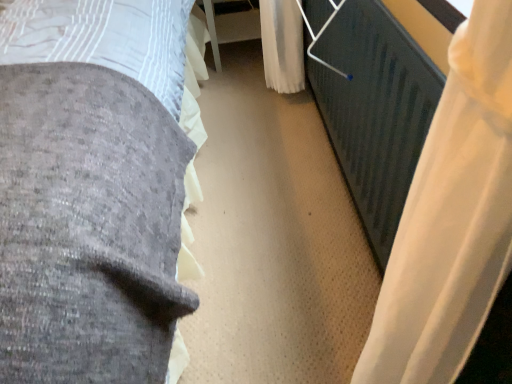
What is the approximate width of velvet gray bed at left?

velvet gray bed at left is 2.17 meters in width.

What do you see at coordinates (451, 217) in the screenshot? This screenshot has width=512, height=384. I see `white sheer curtain at right` at bounding box center [451, 217].

The image size is (512, 384). I want to click on white plastic table at center, so click(x=229, y=27).

Identify the location of table that is on the right side of velvet gray bed at left. This screenshot has width=512, height=384. (229, 27).

Visually, is velvet gray bed at left positioned to the left or to the right of white plastic table at center?

Clearly, velvet gray bed at left is on the left of white plastic table at center in the image.

Is velvet gray bed at left taller or shorter than white plastic table at center?

In the image, velvet gray bed at left appears to be taller than white plastic table at center.

Which object is further away from the camera, velvet gray bed at left or white plastic table at center?

white plastic table at center is further from the camera.

Between white sheer curtain at right and white plastic table at center, which one has larger size?

With larger size is white plastic table at center.

From the image's perspective, would you say white sheer curtain at right is positioned over white plastic table at center?

No, from the image's perspective, white sheer curtain at right is not on top of white plastic table at center.

Does white sheer curtain at right come in front of white plastic table at center?

Yes, white sheer curtain at right is closer to the viewer.

Is white sheer curtain at right with white plastic table at center?

They are not placed beside each other.

Between velvet gray bed at left and white sheer curtain at right, which one has larger size?

velvet gray bed at left.

Considering the relative positions of velvet gray bed at left and white sheer curtain at right in the image provided, is velvet gray bed at left in front of white sheer curtain at right?

Yes, the depth of velvet gray bed at left is less than that of white sheer curtain at right.

Between velvet gray bed at left and white sheer curtain at right, which one has larger width?

Wider between the two is velvet gray bed at left.

Is velvet gray bed at left not close to white sheer curtain at right?

No, velvet gray bed at left is in close proximity to white sheer curtain at right.

Considering the sizes of objects white sheer curtain at right and velvet gray bed at left in the image provided, who is thinner, white sheer curtain at right or velvet gray bed at left?

With smaller width is white sheer curtain at right.

Is white sheer curtain at right facing towards velvet gray bed at left?

Yes, white sheer curtain at right is oriented towards velvet gray bed at left.

Can you see white sheer curtain at right touching velvet gray bed at left?

white sheer curtain at right and velvet gray bed at left are clearly separated.

Does white plastic table at center appear on the right side of velvet gray bed at left?

Yes.

Can we say white plastic table at center lies outside velvet gray bed at left?

No, white plastic table at center is not outside of velvet gray bed at left.

Consider the image. Can you confirm if white plastic table at center is wider than velvet gray bed at left?

Incorrect, the width of white plastic table at center does not surpass that of velvet gray bed at left.

Based on the photo, could you tell me if white plastic table at center is facing velvet gray bed at left?

Yes.

Is the surface of white plastic table at center in direct contact with white sheer curtain at right?

white plastic table at center and white sheer curtain at right are clearly separated.

From the image's perspective, does white plastic table at center appear higher than white sheer curtain at right?

Yes, from the image's perspective, white plastic table at center is on top of white sheer curtain at right.

Does white plastic table at center lie behind white sheer curtain at right?

Yes, it is behind white sheer curtain at right.

Considering the relative sizes of white plastic table at center and white sheer curtain at right in the image provided, is white plastic table at center wider than white sheer curtain at right?

Yes, white plastic table at center is wider than white sheer curtain at right.

The image size is (512, 384). What are the coordinates of `table that appears above the velvet gray bed at left (from the image's perspective)` in the screenshot? It's located at pyautogui.click(x=229, y=27).

The height and width of the screenshot is (384, 512). I want to click on curtain below the white plastic table at center (from the image's perspective), so click(x=451, y=217).

Considering their positions, is velvet gray bed at left positioned closer to white sheer curtain at right than white plastic table at center?

velvet gray bed at left.

Which object lies further to the anchor point white sheer curtain at right, white plastic table at center or velvet gray bed at left?

white plastic table at center is positioned further to the anchor white sheer curtain at right.

Considering their positions, is white sheer curtain at right positioned further to velvet gray bed at left than white plastic table at center?

white plastic table at center lies further to velvet gray bed at left than the other object.

Looking at the image, which one is located further to white plastic table at center, velvet gray bed at left or white sheer curtain at right?

white sheer curtain at right is further to white plastic table at center.

Looking at the image, which one is located closer to velvet gray bed at left, white plastic table at center or white sheer curtain at right?

white sheer curtain at right lies closer to velvet gray bed at left than the other object.

Based on their spatial positions, is white sheer curtain at right or velvet gray bed at left closer to white plastic table at center?

velvet gray bed at left.

Identify the location of curtain positioned between velvet gray bed at left and white plastic table at center from near to far. (451, 217).